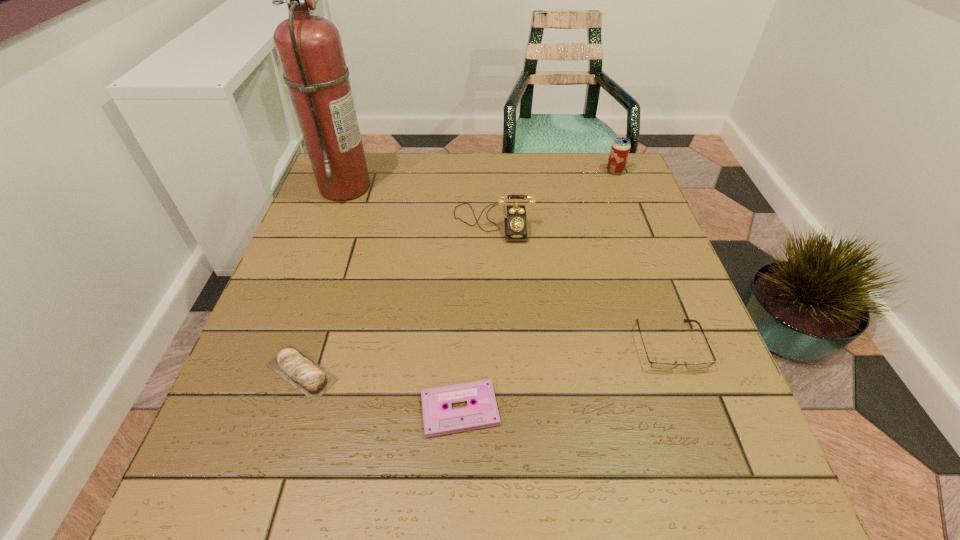
The width and height of the screenshot is (960, 540). I want to click on vacant space at the far edge, so click(x=535, y=154).

This screenshot has width=960, height=540. What are the coordinates of `free space at the left edge` in the screenshot? It's located at tap(287, 273).

The height and width of the screenshot is (540, 960). In the image, there is a desktop. Find the location of `vacant space at the right edge`. vacant space at the right edge is located at coordinates (670, 314).

In the image, there is a desktop. Where is `vacant region at the far left corner`? This screenshot has width=960, height=540. vacant region at the far left corner is located at coordinates (377, 170).

The width and height of the screenshot is (960, 540). I want to click on vacant space at the far right corner of the desktop, so click(639, 193).

Identify the location of free space at the near right corner. (756, 458).

The width and height of the screenshot is (960, 540). What are the coordinates of `unoccupied position between the pita bread and the videotape` in the screenshot? It's located at (381, 391).

Locate an element on the screen. This screenshot has height=540, width=960. vacant area that lies between the pita bread and the beer can is located at coordinates (459, 272).

Locate an element on the screen. The width and height of the screenshot is (960, 540). vacant area between the telephone and the pita bread is located at coordinates (397, 298).

This screenshot has height=540, width=960. I want to click on vacant area that lies between the spectacles and the tallest object, so click(x=508, y=266).